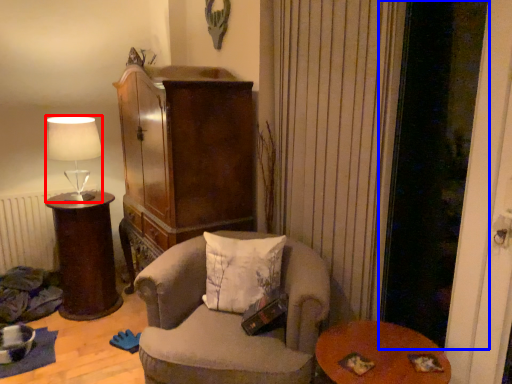
Question: Which point is further to the camera, lamp (highlighted by a red box) or screen door (highlighted by a blue box)?

Choices:
 (A) lamp
 (B) screen door

Answer: (A)